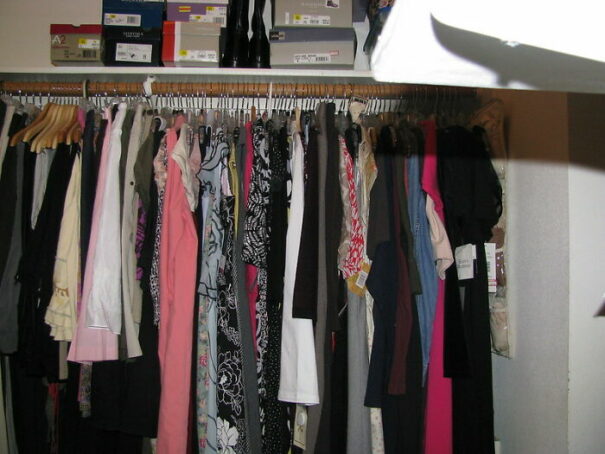
Locate an element on the screen. This screenshot has height=454, width=605. collection of wooden hangers is located at coordinates click(x=57, y=114).